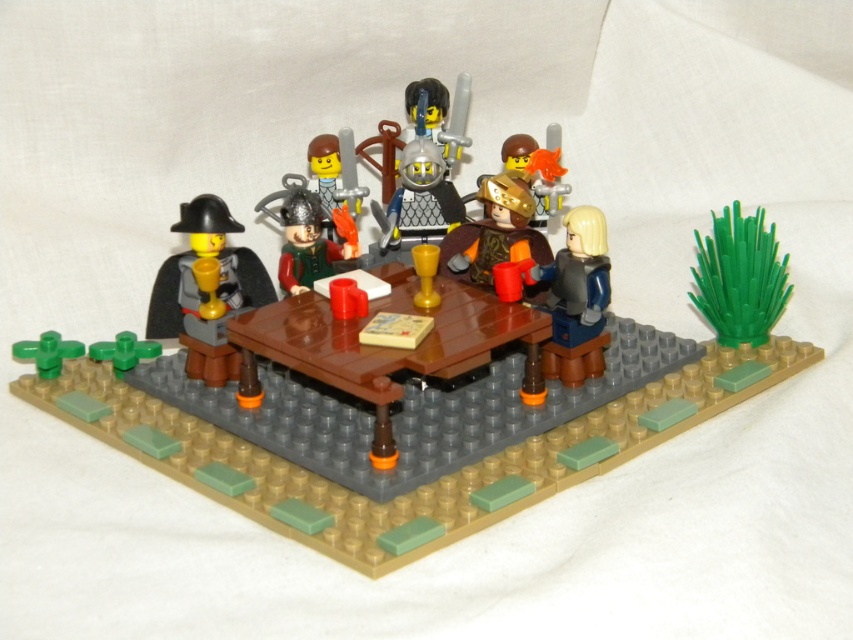
Question: Does brown wooden table at center have a lesser width compared to smooth gray vest at lower right?

Choices:
 (A) yes
 (B) no

Answer: (B)

Question: Among these points, which one is farthest from the camera?

Choices:
 (A) (196, 371)
 (B) (341, 220)
 (C) (381, 308)
 (D) (509, 228)

Answer: (B)

Question: Considering the real-world distances, which object is closest to the matte green armor at center?

Choices:
 (A) matte black hat at left
 (B) smooth gray vest at lower right
 (C) gold metallic helmet at center

Answer: (A)

Question: Does matte black hat at left appear on the left side of silver metallic helmet at center?

Choices:
 (A) yes
 (B) no

Answer: (A)

Question: Which point is farther to the camera?

Choices:
 (A) brown wooden table at center
 (B) gold metallic helmet at center

Answer: (B)

Question: Is silver metallic helmet at center behind matte green armor at center?

Choices:
 (A) no
 (B) yes

Answer: (B)